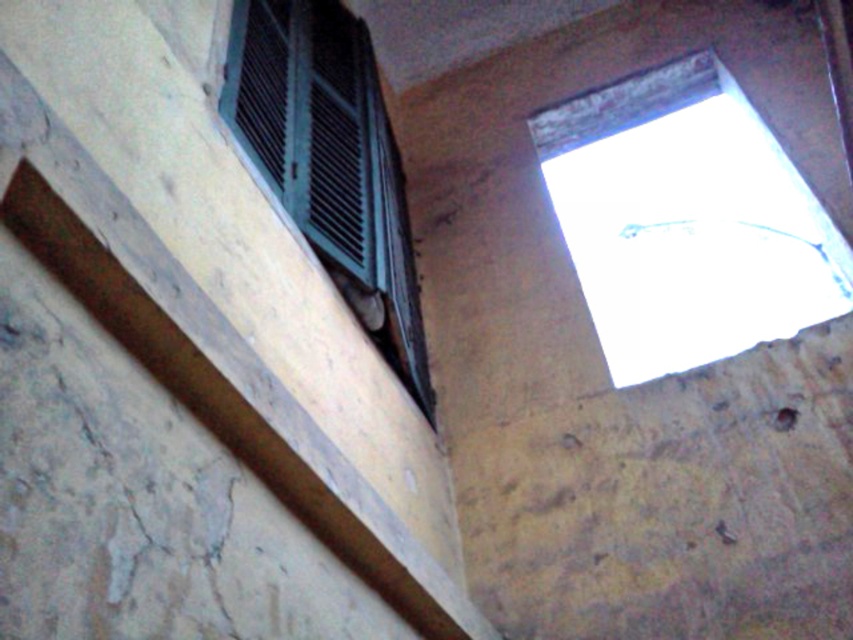
What do you see at coordinates (225, 387) in the screenshot? This screenshot has height=640, width=853. I see `brown wood beam at upper left` at bounding box center [225, 387].

Which is in front, point (140, 296) or point (386, 285)?

Point (140, 296) is in front.

Find the location of `brown wood beam at upper left`. brown wood beam at upper left is located at coordinates (225, 387).

Between point (584, 108) and point (236, 356), which one is positioned behind?

Positioned behind is point (584, 108).

How much distance is there between transparent glass window at upper right and brown wood beam at upper left?

A distance of 2.44 meters exists between transparent glass window at upper right and brown wood beam at upper left.

This screenshot has height=640, width=853. Identify the location of transparent glass window at upper right. (686, 220).

This screenshot has width=853, height=640. In order to click on transparent glass window at upper right in this screenshot , I will do `click(686, 220)`.

Is transparent glass window at upper right behind green matte window at upper left?

That is True.

Can you confirm if transparent glass window at upper right is positioned above green matte window at upper left?

No, transparent glass window at upper right is not above green matte window at upper left.

In order to click on transparent glass window at upper right in this screenshot , I will do `click(686, 220)`.